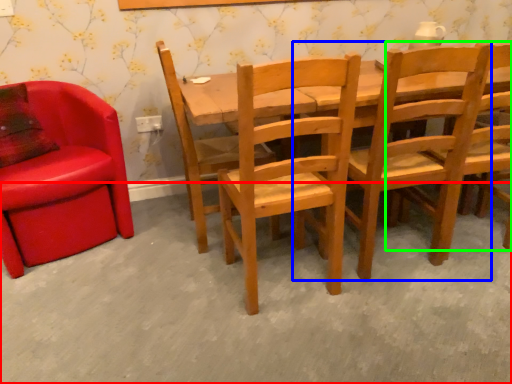
Question: Estimate the real-world distances between objects in this image. Which object is farther from concrete (highlighted by a red box), chair (highlighted by a blue box) or chair (highlighted by a green box)?

Choices:
 (A) chair
 (B) chair

Answer: (B)